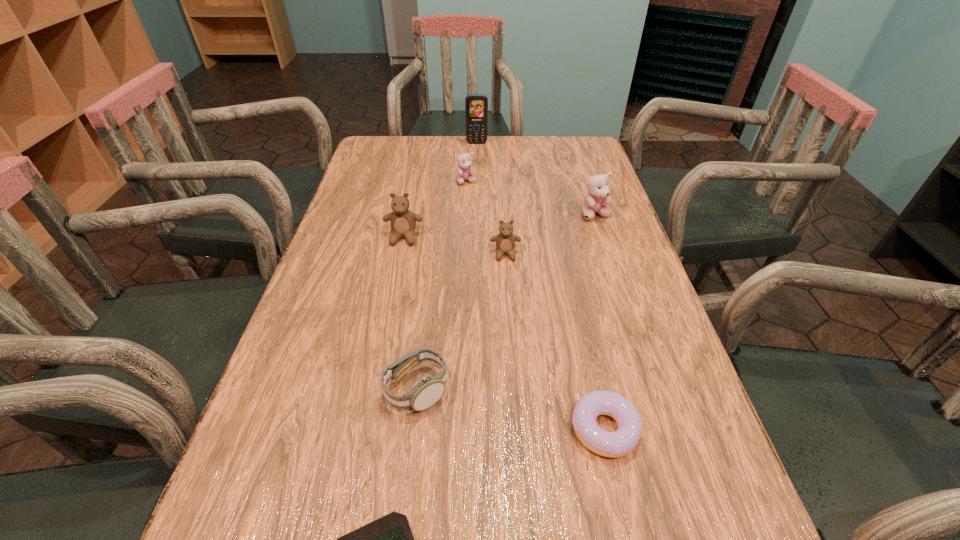
Identify the location of vacant area that lies between the leftmost teddy bear and the farthest teddy bear. (435, 210).

Find the location of `free spot between the watch and the smaller pink teddy bear`. free spot between the watch and the smaller pink teddy bear is located at coordinates (442, 286).

Where is `vacant space that is in between the farthest teddy bear and the left brown teddy bear`? Image resolution: width=960 pixels, height=540 pixels. vacant space that is in between the farthest teddy bear and the left brown teddy bear is located at coordinates (435, 210).

Where is `vacant space that's between the rightmost object and the third shortest object`? vacant space that's between the rightmost object and the third shortest object is located at coordinates point(506,302).

I want to click on vacant point located between the right brown teddy bear and the third teddy bear from right to left, so click(x=486, y=218).

The height and width of the screenshot is (540, 960). Identify the location of free space that is in between the farthest teddy bear and the second shortest object. (536, 305).

Locate an element on the screen. The height and width of the screenshot is (540, 960). object that is the fifth closest to the smaller brown teddy bear is located at coordinates (613, 444).

Choose which object is the second nearest neighbor to the second teddy bear from left to right. Please provide its 2D coordinates. Your answer should be formatted as a tuple, i.e. [(x, y)], where the tuple contains the x and y coordinates of a point satisfying the conditions above.

[(403, 222)]

The width and height of the screenshot is (960, 540). Identify the location of the closest teddy bear to the seventh object from left to right. (505, 241).

Point out which teddy bear is positioned as the fourth nearest to the second object from right to left. Please provide its 2D coordinates. Your answer should be formatted as a tuple, i.e. [(x, y)], where the tuple contains the x and y coordinates of a point satisfying the conditions above.

[(465, 170)]